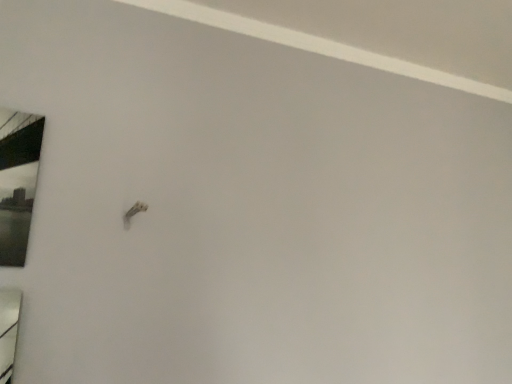
I want to click on matte black mirror at left, so click(18, 181).

Describe the element at coordinates (18, 181) in the screenshot. I see `matte black mirror at left` at that location.

The height and width of the screenshot is (384, 512). I want to click on matte black mirror at left, so click(x=18, y=181).